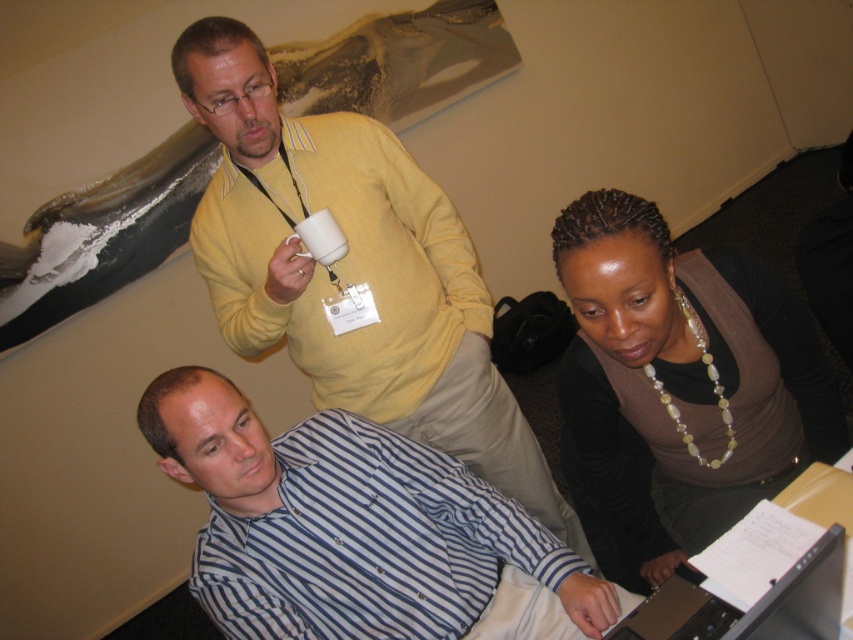
Question: Which is nearer to the yellow sweater at upper center?

Choices:
 (A) white matte mug at upper center
 (B) silver metallic laptop at lower right

Answer: (A)

Question: Which object is farther from the camera taking this photo?

Choices:
 (A) yellow sweater at upper center
 (B) white matte mug at upper center
 (C) silver metallic laptop at lower right
 (D) blue striped shirt at lower left

Answer: (B)

Question: Which point is farther from the camera taking this photo?

Choices:
 (A) (322, 220)
 (B) (669, 234)
 (C) (416, 545)

Answer: (B)

Question: Does blue striped shirt at lower left appear over silver metallic laptop at lower right?

Choices:
 (A) yes
 (B) no

Answer: (B)

Question: Can you confirm if blue striped shirt at lower left is positioned to the right of white matte mug at upper center?

Choices:
 (A) yes
 (B) no

Answer: (A)

Question: Can you confirm if yellow sweater at upper center is bigger than brown matte sweater at lower right?

Choices:
 (A) no
 (B) yes

Answer: (B)